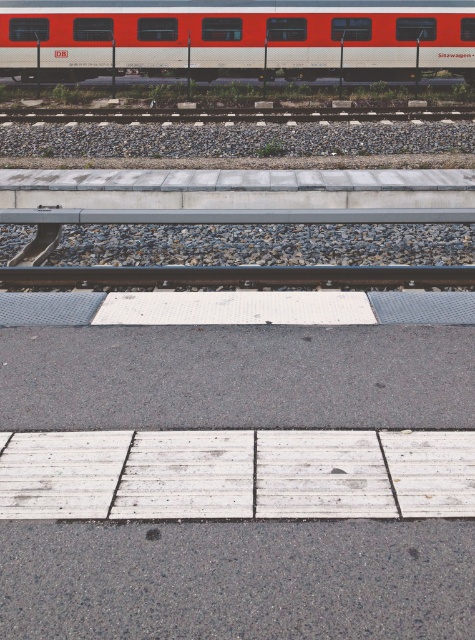
Question: Which point is closer to the camera?

Choices:
 (A) (262, 284)
 (B) (88, 28)

Answer: (A)

Question: Which object is farther from the camera taking this photo?

Choices:
 (A) black rubber train track at center
 (B) red/white passenger train at upper left

Answer: (B)

Question: Among these objects, which one is nearest to the camera?

Choices:
 (A) red/white passenger train at upper left
 (B) black rubber train track at center

Answer: (B)

Question: Can you confirm if red/white passenger train at upper left is wider than black rubber train track at center?

Choices:
 (A) yes
 (B) no

Answer: (A)

Question: Considering the relative positions of red/white passenger train at upper left and black rubber train track at center in the image provided, where is red/white passenger train at upper left located with respect to black rubber train track at center?

Choices:
 (A) left
 (B) right

Answer: (B)

Question: Is red/white passenger train at upper left closer to camera compared to black rubber train track at center?

Choices:
 (A) no
 (B) yes

Answer: (A)